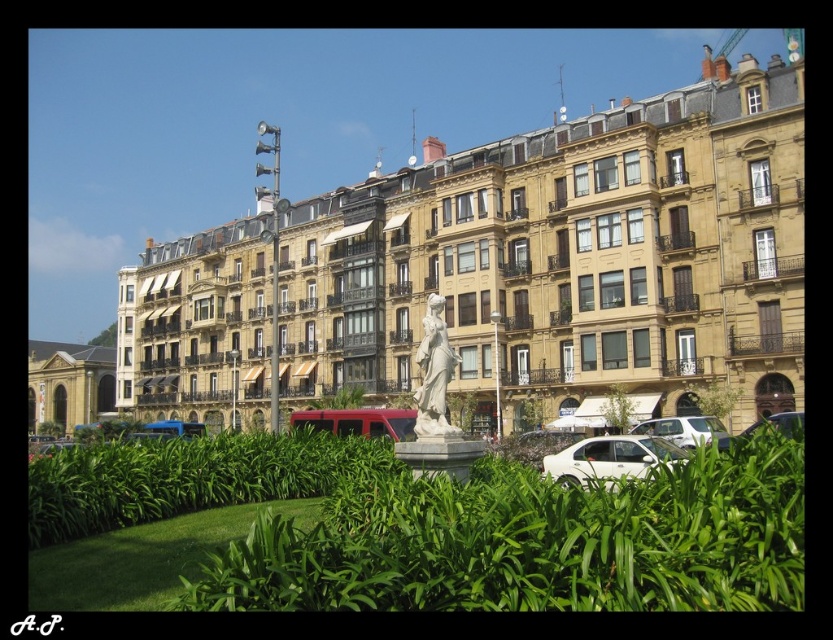
You are standing at the point marked as point (185, 477) in the image. What can you see immediately around you?

You can see green leafy shrubs at center immediately around you.